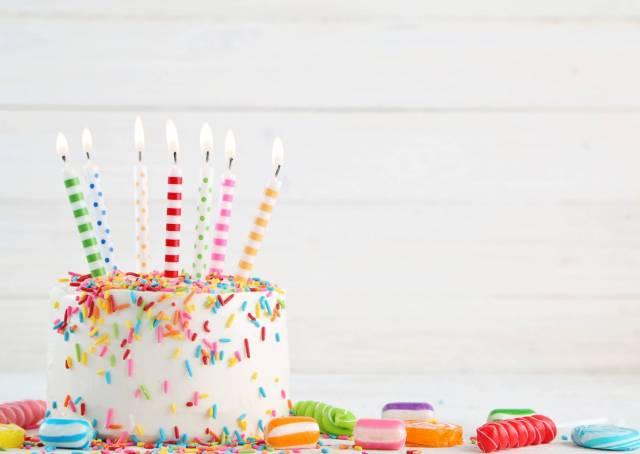
At what (x,y) coordinates should I click in order to perform the action: click on candle flames. Please return your answer as a coordinate pair (x, y). Image resolution: width=640 pixels, height=454 pixels. Looking at the image, I should click on (60, 141), (88, 136), (134, 130), (168, 132), (209, 139), (227, 140), (276, 152).